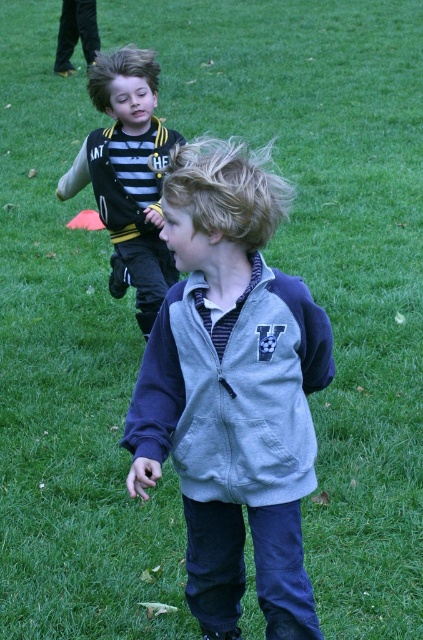
You are a photographer trying to capture a candid shot of both the gray fleece jacket at center and the striped jersey at left. Since you want to ensure both subjects are in focus, you need to know their positions relative to each other. Which object is positioned lower in the frame?

The gray fleece jacket at center is located below striped jersey at left, so the gray fleece jacket at center is positioned lower in the frame.

Two boys are playing soccer on a field. The first boy is wearing a gray fleece jacket at center. The second boy is behind and to the left of him. If the distance between them is 2.48 meters, can a soccer ball placed exactly halfway between them roll to either boy without any interference?

The distance between the two boys is 2.48 meters, so the halfway point is 1.24 meters from each. A soccer ball placed there would roll towards whichever boy moves closer first, but without interference, it would remain stationary unless acted upon by an external force.